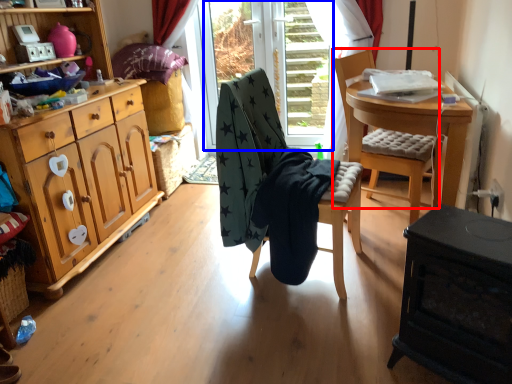
Question: Which object is further to the camera taking this photo, chair (highlighted by a red box) or glass door (highlighted by a blue box)?

Choices:
 (A) chair
 (B) glass door

Answer: (B)